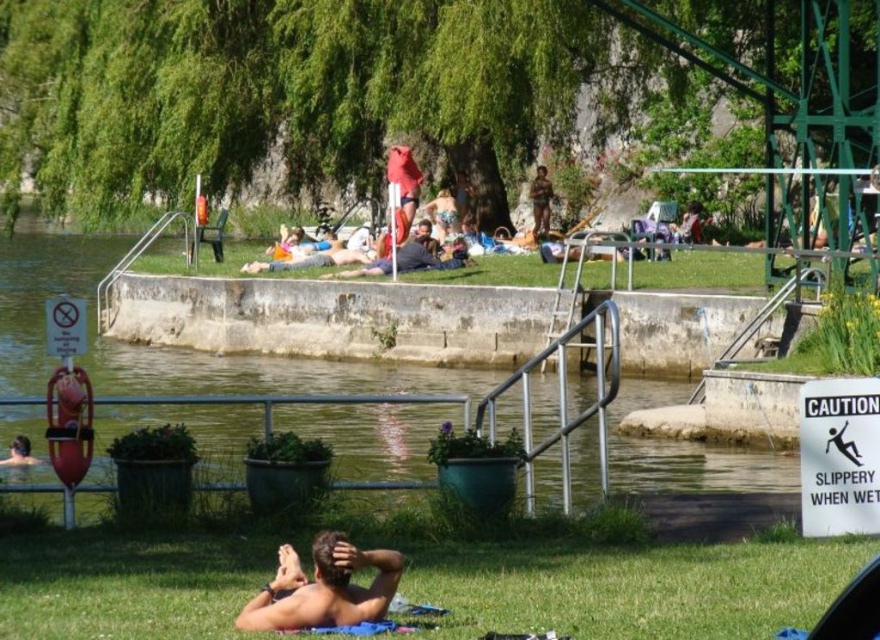
You are a lifeguard on duty at the riverside. You notice a swimmer in the green concrete river at center and a person wearing brown textured shorts at center. Which object is located below the other?

The green concrete river at center is positioned under brown textured shorts at center, so the river is below the person wearing the shorts.

You are standing at the point marked by the coordinates point (327, 317) in the image. What is the immediate environment around you like?

The point (327, 317) marks the green concrete river at center, so you are standing on the green concrete river at center.